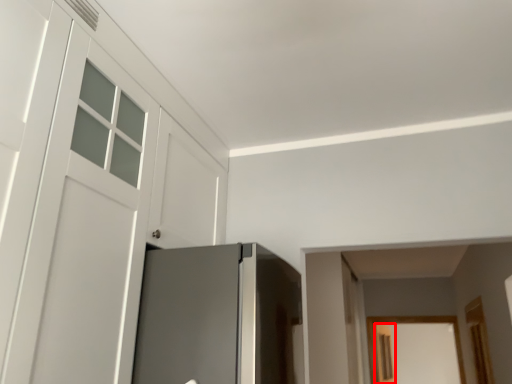
Question: From the image's perspective, what is the correct spatial relationship of screen door (annotated by the red box) in relation to door?

Choices:
 (A) above
 (B) below

Answer: (B)